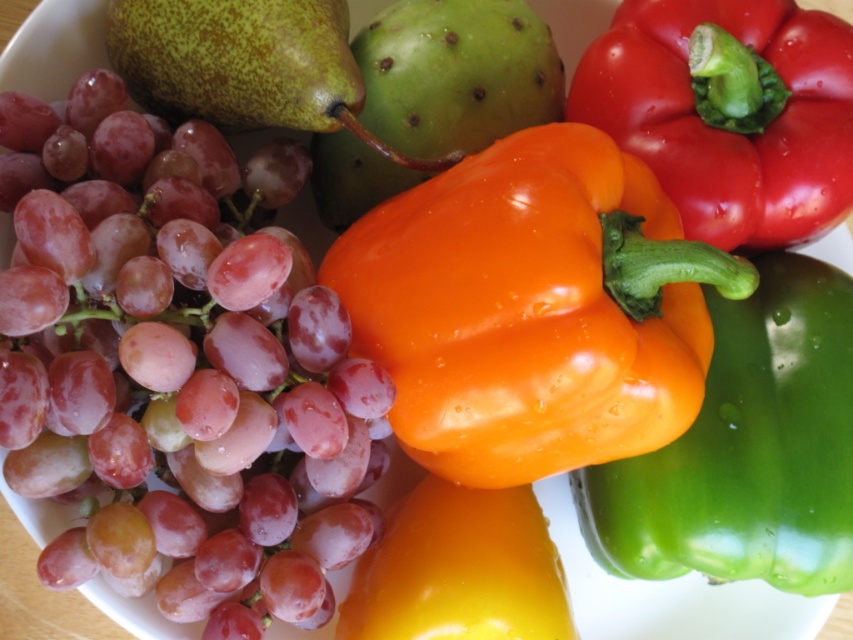
You are arranging a fruit platter and need to know the position of the glossy red grapes at left relative to the shiny orange bell pepper at center. Are the grapes above or below the pepper?

The glossy red grapes at left is above the shiny orange bell pepper at center.

You are arranging fruits and vegetables in a bowl. You have a shiny orange bell pepper at center and a shiny red bell pepper at upper right. Which one is positioned more to the left?

The shiny orange bell pepper at center is positioned more to the left than the shiny red bell pepper at upper right.

You are arranging fruits and vegetables in a display. You have the glossy red grapes at left and the shiny red bell pepper at upper right. Which object takes up more space in the arrangement?

The glossy red grapes at left takes up more space in the arrangement because it has a larger size compared to the shiny red bell pepper at upper right.